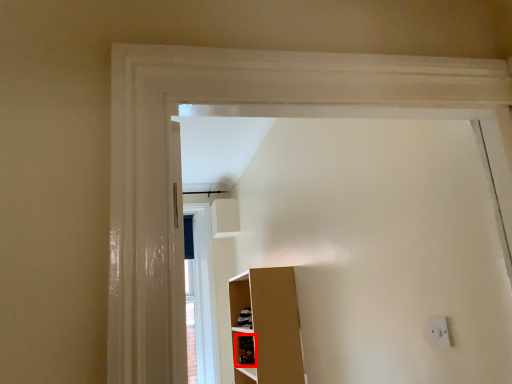
Question: From the image, what is the correct spatial relationship of cabinet (annotated by the red box) in relation to electric outlet?

Choices:
 (A) right
 (B) left

Answer: (B)